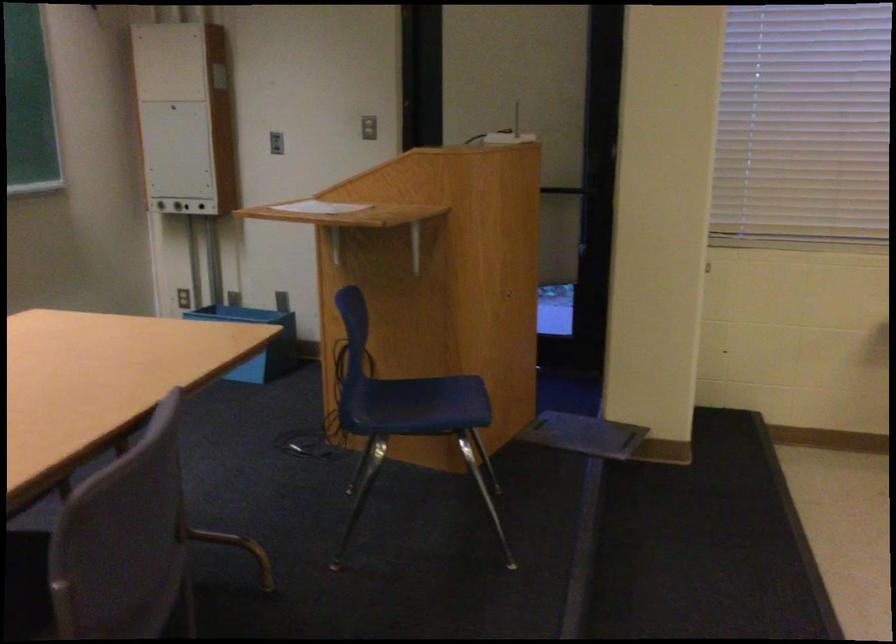
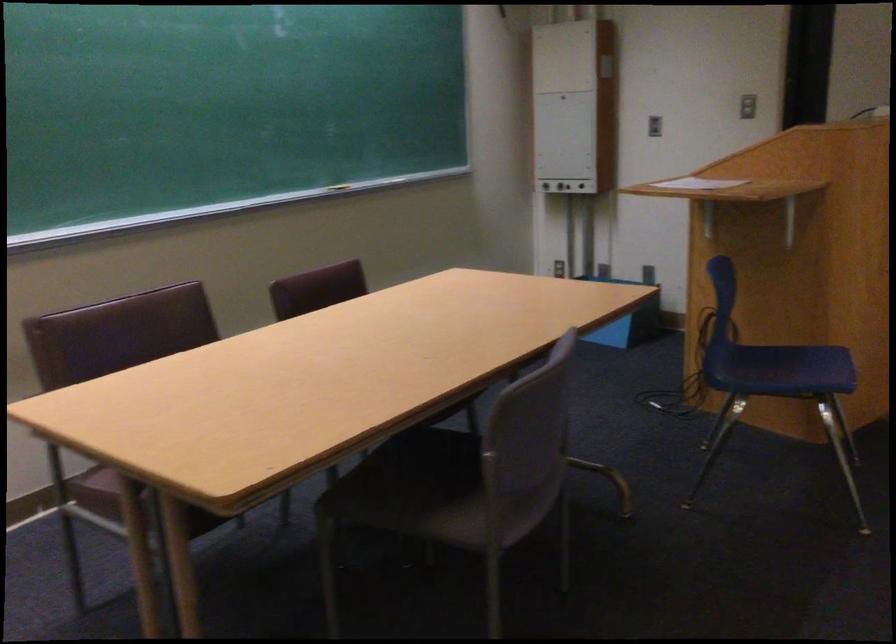
Locate, in the second image, the point that corresponds to point (419, 406) in the first image.

(782, 368)